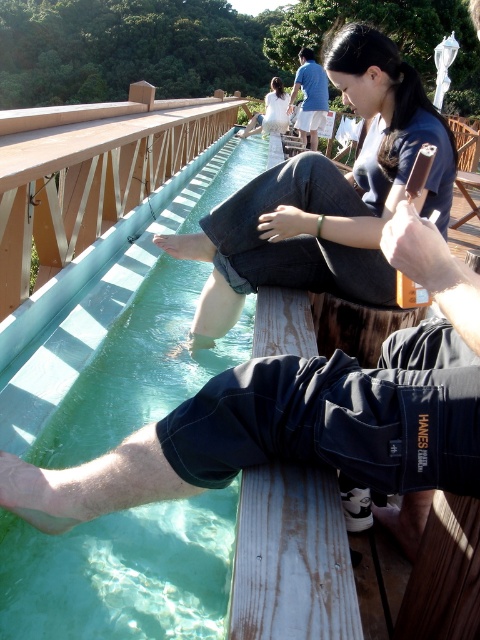
Question: Which object is positioned farthest from the denim jeans at center?

Choices:
 (A) clear glass water at center
 (B) blue cotton shirt at upper center

Answer: (B)

Question: Which of these objects is positioned closest to the clear glass water at center?

Choices:
 (A) blue cotton shirt at upper center
 (B) denim jeans at center

Answer: (B)

Question: Where is clear glass water at center located in relation to blue cotton shirt at upper center in the image?

Choices:
 (A) right
 (B) left

Answer: (B)

Question: Does clear glass water at center have a smaller size compared to denim jeans at center?

Choices:
 (A) yes
 (B) no

Answer: (B)

Question: Which point is closer to the camera?

Choices:
 (A) (303, 77)
 (B) (162, 241)
 (C) (166, 593)

Answer: (C)

Question: Is clear glass water at center smaller than blue cotton shirt at upper center?

Choices:
 (A) yes
 (B) no

Answer: (B)